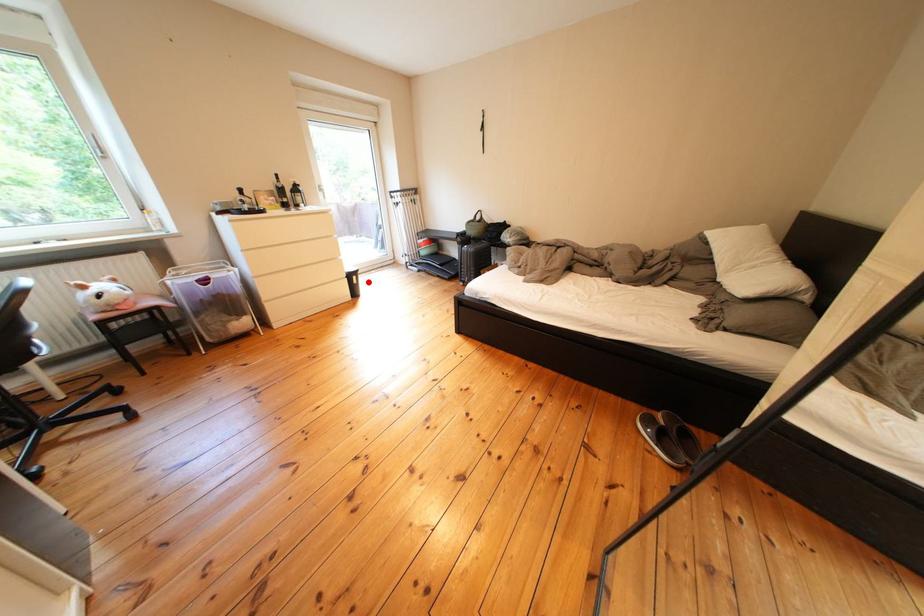
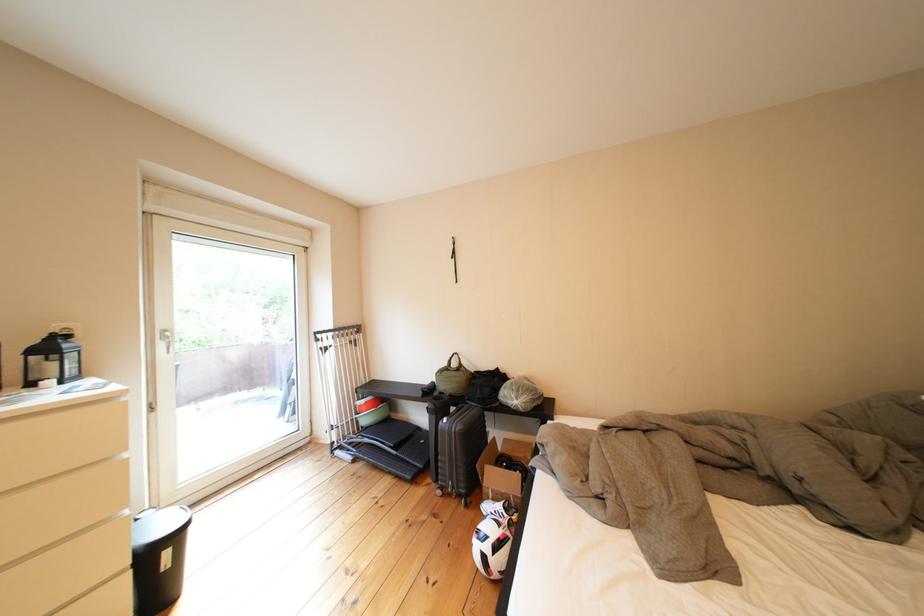
The point at the highlighted location is marked in the first image. Where is the corresponding point in the second image?

(179, 557)